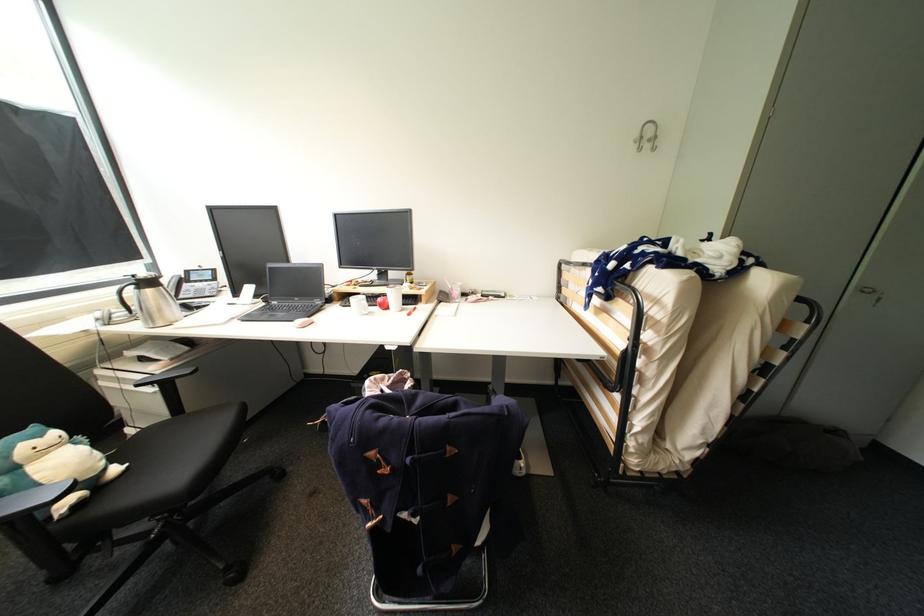
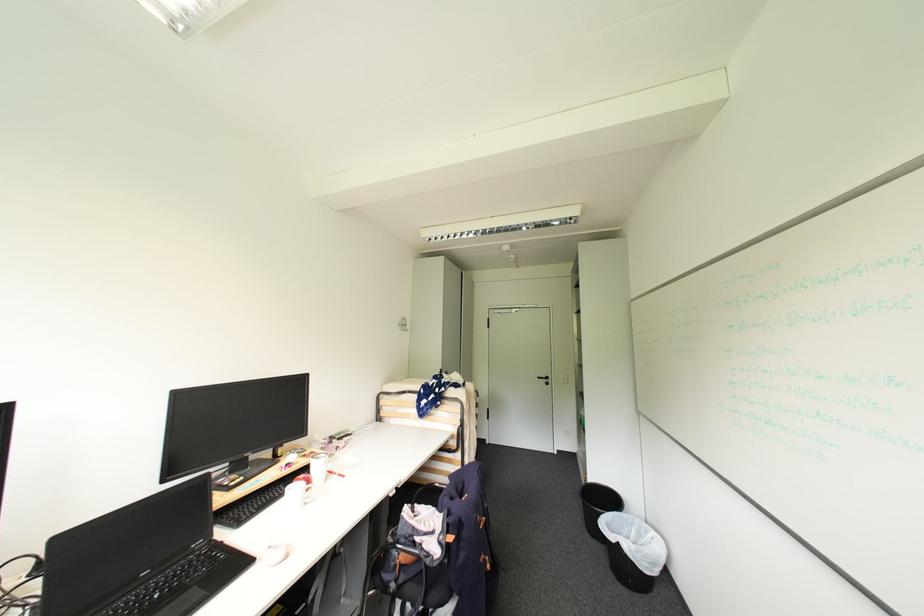
Where in the second image is the point corresponding to point (416, 376) from the first image?

(417, 506)